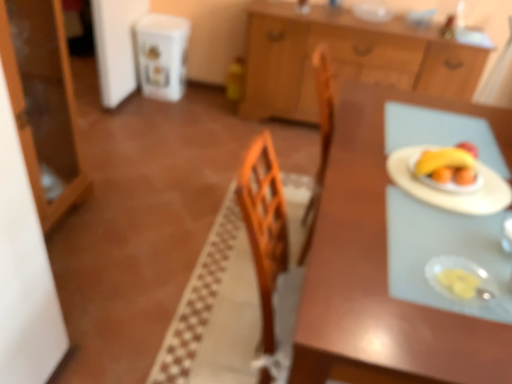
Where is `vacant space situated on the left part of white paper plate at right`? The image size is (512, 384). vacant space situated on the left part of white paper plate at right is located at coordinates (355, 173).